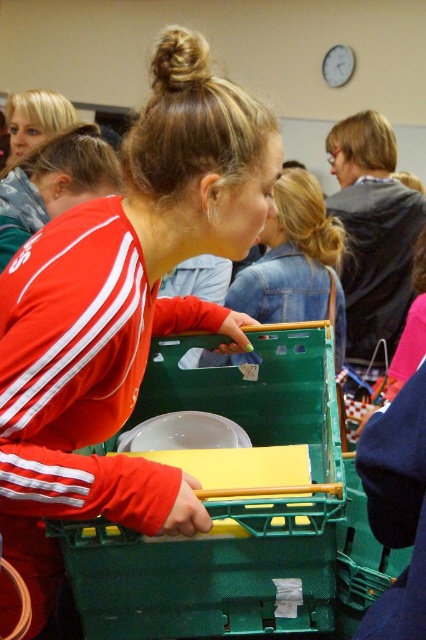
Based on the photo, you are standing in a community event and see a young woman holding a green plastic crate with a yellow folder and white plate inside. There is a point marked at coordinates (123, 310). Based on the scene description, where is this point located?

The point at coordinates (123, 310) is located on the matte red jacket at center.

You are organizing a community event and need to place the matte red jacket at center and the matte plastic shopping cart at center in a specific arrangement. According to the scene, which object is positioned to the left of the other?

The matte red jacket at center is to the left of the matte plastic shopping cart at center.

You are organizing a community event and need to know the relative positions of the matte red jacket at center and the green plastic crate at center. Which object is positioned to the left from your perspective?

The matte red jacket at center is to the left of the green plastic crate at center, so the matte red jacket at center is positioned to the left.